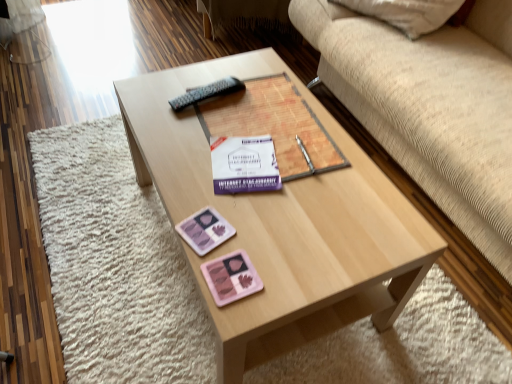
I want to click on vacant area that lies between purple matte book at center and pink matte eyeshadow palette at lower center, which is the 1th currency from bottom to top, so click(260, 208).